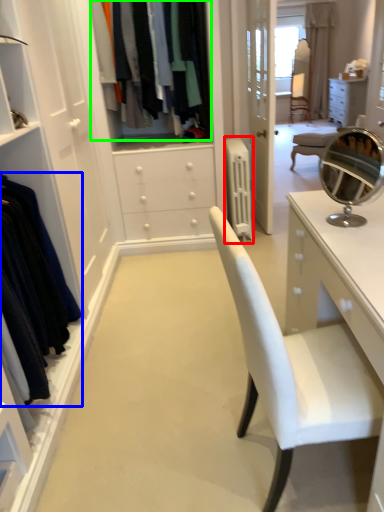
Question: Based on their relative distances, which object is nearer to radiator (highlighted by a red box)? Choose from clothing (highlighted by a blue box) and clothing (highlighted by a green box).

Choices:
 (A) clothing
 (B) clothing

Answer: (B)